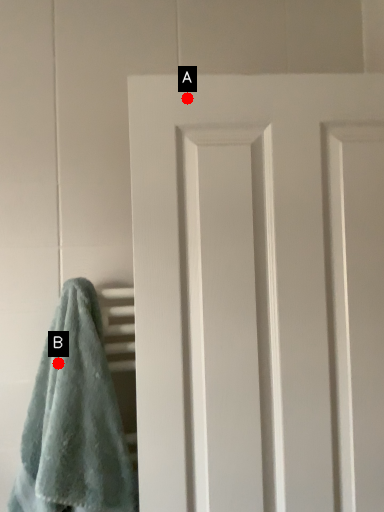
Question: Two points are circled on the image, labeled by A and B beside each circle. Which point is closer to the camera taking this photo?

Choices:
 (A) A is closer
 (B) B is closer

Answer: (A)